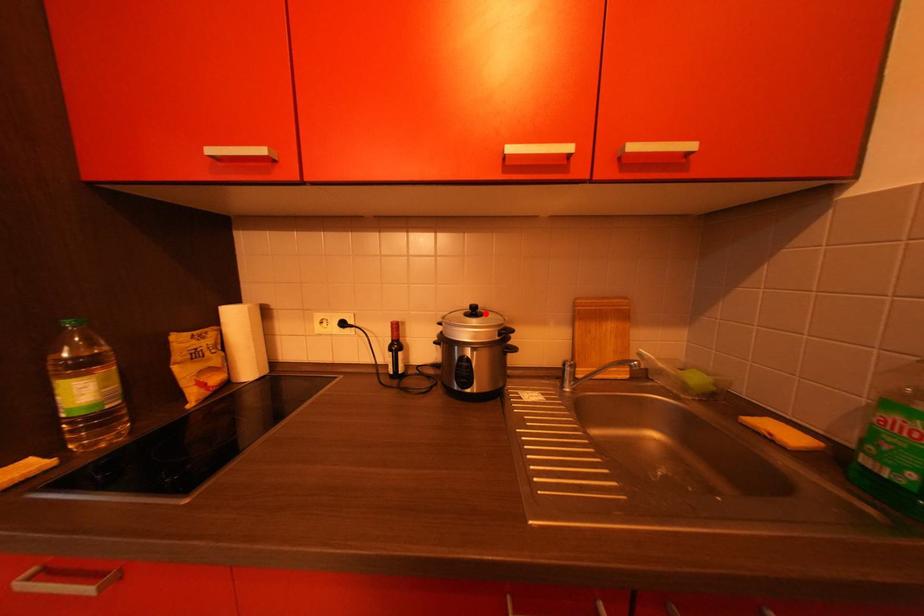
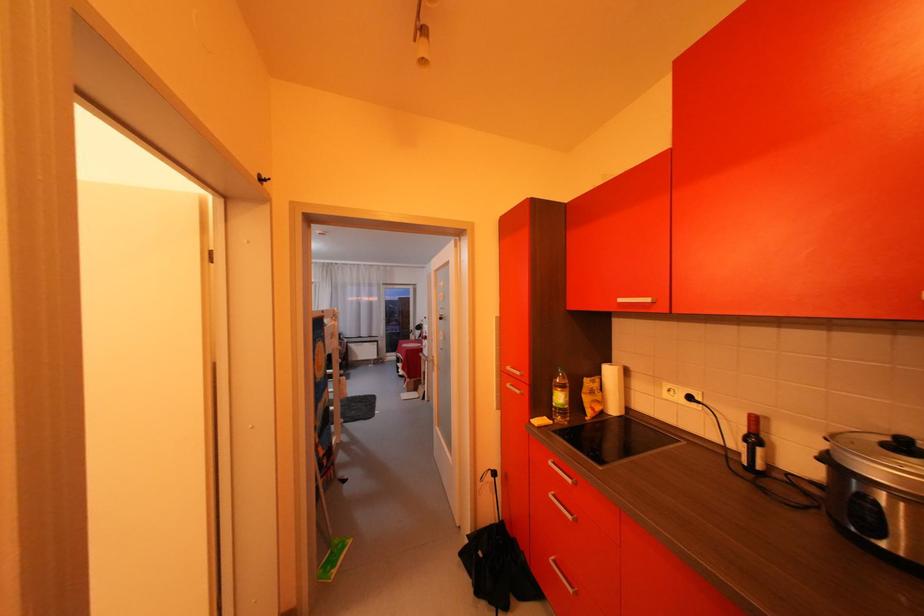
Where in the second image is the point corresponding to the highlighted location from the first image?

(917, 448)